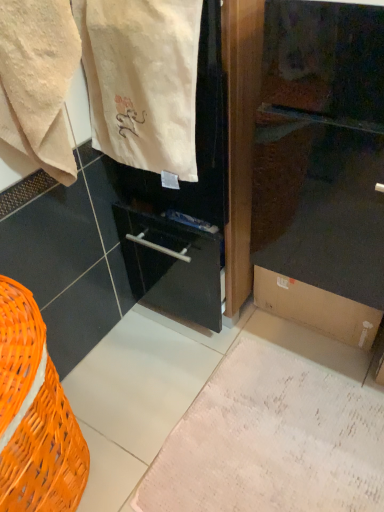
You are a GUI agent. You are given a task and a screenshot of the screen. Output one action in this format:
    pyautogui.click(x=<x>, y=<y>)
    Task: Click on the brown cardboard box at lower right
    This screenshot has width=384, height=512.
    Given the screenshot: What is the action you would take?
    pyautogui.click(x=316, y=308)

Image resolution: width=384 pixels, height=512 pixels. What do you see at coordinates (271, 441) in the screenshot?
I see `white textured rug at lower center` at bounding box center [271, 441].

Find the location of `brown cardboard box at lower right`. brown cardboard box at lower right is located at coordinates pos(316,308).

From the image's perspective, is orange wicker basket at lower left above or below beige cotton towel at upper left?

Clearly, from the image's perspective, orange wicker basket at lower left is below beige cotton towel at upper left.

Does orange wicker basket at lower left have a lesser height compared to beige cotton towel at upper left?

In fact, orange wicker basket at lower left may be taller than beige cotton towel at upper left.

Looking at this image, does orange wicker basket at lower left appear on the left side of beige cotton towel at upper left?

Yes.

The image size is (384, 512). I want to click on cardboard box below the beige cotton towel at upper left (from a real-world perspective), so click(316, 308).

Are brown cardboard box at lower right and beige cotton towel at upper left beside each other?

brown cardboard box at lower right is not next to beige cotton towel at upper left, and they're not touching.

Looking at their sizes, would you say brown cardboard box at lower right is wider or thinner than beige cotton towel at upper left?

brown cardboard box at lower right is wider than beige cotton towel at upper left.

Choose the correct answer: Is brown cardboard box at lower right inside beige cotton towel at upper left or outside it?

brown cardboard box at lower right lies outside beige cotton towel at upper left.

Which of these two, brown cardboard box at lower right or white textured rug at lower center, is bigger?

Bigger between the two is brown cardboard box at lower right.

Which is more to the left, brown cardboard box at lower right or white textured rug at lower center?

white textured rug at lower center.

From a real-world perspective, is brown cardboard box at lower right above or below white textured rug at lower center?

From a real-world perspective, brown cardboard box at lower right is physically above white textured rug at lower center.

Could you tell me if brown cardboard box at lower right is facing white textured rug at lower center?

Yes, brown cardboard box at lower right faces towards white textured rug at lower center.

From a real-world perspective, is white textured rug at lower center physically located above or below beige cotton towel at upper left?

Clearly, from a real-world perspective, white textured rug at lower center is below beige cotton towel at upper left.

From the image's perspective, which object appears higher, white textured rug at lower center or beige cotton towel at upper left?

beige cotton towel at upper left, from the image's perspective.

In the image, is white textured rug at lower center positioned in front of or behind beige cotton towel at upper left?

In the image, white textured rug at lower center appears behind beige cotton towel at upper left.

Find the location of a particular element. This screenshot has height=512, width=384. cardboard box behind the orange wicker basket at lower left is located at coordinates (316, 308).

Is brown cardboard box at lower right facing towards orange wicker basket at lower left?

Yes, brown cardboard box at lower right is turned towards orange wicker basket at lower left.

How different are the orientations of brown cardboard box at lower right and orange wicker basket at lower left in degrees?

The facing directions of brown cardboard box at lower right and orange wicker basket at lower left are 89.3 degrees apart.

Considering the relative sizes of brown cardboard box at lower right and orange wicker basket at lower left in the image provided, is brown cardboard box at lower right wider than orange wicker basket at lower left?

No.

Considering the relative positions of beige cotton towel at upper left and orange wicker basket at lower left in the image provided, is beige cotton towel at upper left behind orange wicker basket at lower left?

Yes, beige cotton towel at upper left is further from the camera.

Is beige cotton towel at upper left wider than orange wicker basket at lower left?

No, beige cotton towel at upper left is not wider than orange wicker basket at lower left.

Is beige cotton towel at upper left next to orange wicker basket at lower left?

No.

Image resolution: width=384 pixels, height=512 pixels. What are the coordinates of `towel on the right side of orange wicker basket at lower left` in the screenshot? It's located at (38, 81).

Who is bigger, white textured rug at lower center or orange wicker basket at lower left?

Result: With larger size is orange wicker basket at lower left.

From a real-world perspective, between white textured rug at lower center and orange wicker basket at lower left, who is vertically lower?

white textured rug at lower center.

Considering the sizes of white textured rug at lower center and orange wicker basket at lower left in the image, is white textured rug at lower center taller or shorter than orange wicker basket at lower left?

Clearly, white textured rug at lower center is shorter compared to orange wicker basket at lower left.

Considering the points (178, 440) and (50, 477), which point is in front, point (178, 440) or point (50, 477)?

The point (50, 477) is in front.

This screenshot has width=384, height=512. Identify the location of basket directly beneath the beige cotton towel at upper left (from a real-world perspective). (35, 415).

Locate an element on the screen. The image size is (384, 512). towel above the brown cardboard box at lower right (from the image's perspective) is located at coordinates (38, 81).

Looking at this image, considering their positions, is white textured rug at lower center positioned closer to orange wicker basket at lower left than beige cotton towel at upper left?

Based on the image, white textured rug at lower center appears to be nearer to orange wicker basket at lower left.

Looking at the image, which one is located further to beige cotton towel at upper left, beige cotton towel at upper left or brown cardboard box at lower right?

brown cardboard box at lower right.

Consider the image. Considering their positions, is orange wicker basket at lower left positioned further to brown cardboard box at lower right than beige cotton towel at upper left?

beige cotton towel at upper left is further to brown cardboard box at lower right.

Considering their positions, is beige cotton towel at upper left positioned closer to brown cardboard box at lower right than white textured rug at lower center?

white textured rug at lower center is closer to brown cardboard box at lower right.

Which object lies further to the anchor point beige cotton towel at upper left, brown cardboard box at lower right or orange wicker basket at lower left?

brown cardboard box at lower right lies further to beige cotton towel at upper left than the other object.

Looking at the image, which one is located further to orange wicker basket at lower left, white textured rug at lower center or beige cotton towel at upper left?

The object further to orange wicker basket at lower left is beige cotton towel at upper left.

Consider the image. When comparing their distances from beige cotton towel at upper left, does brown cardboard box at lower right or white textured rug at lower center seem closer?

brown cardboard box at lower right.

Considering their positions, is beige cotton towel at upper left positioned further to beige cotton towel at upper left than white textured rug at lower center?

white textured rug at lower center lies further to beige cotton towel at upper left than the other object.

I want to click on cardboard box between beige cotton towel at upper left and white textured rug at lower center from top to bottom, so click(x=316, y=308).

The width and height of the screenshot is (384, 512). Identify the location of basket between beige cotton towel at upper left and white textured rug at lower center vertically. (35, 415).

Where is `towel between orange wicker basket at lower left and brown cardboard box at lower right in the horizontal direction`? The height and width of the screenshot is (512, 384). towel between orange wicker basket at lower left and brown cardboard box at lower right in the horizontal direction is located at coordinates (38, 81).

Locate an element on the screen. The width and height of the screenshot is (384, 512). basket between beige cotton towel at upper left and white textured rug at lower center in the up-down direction is located at coordinates (35, 415).